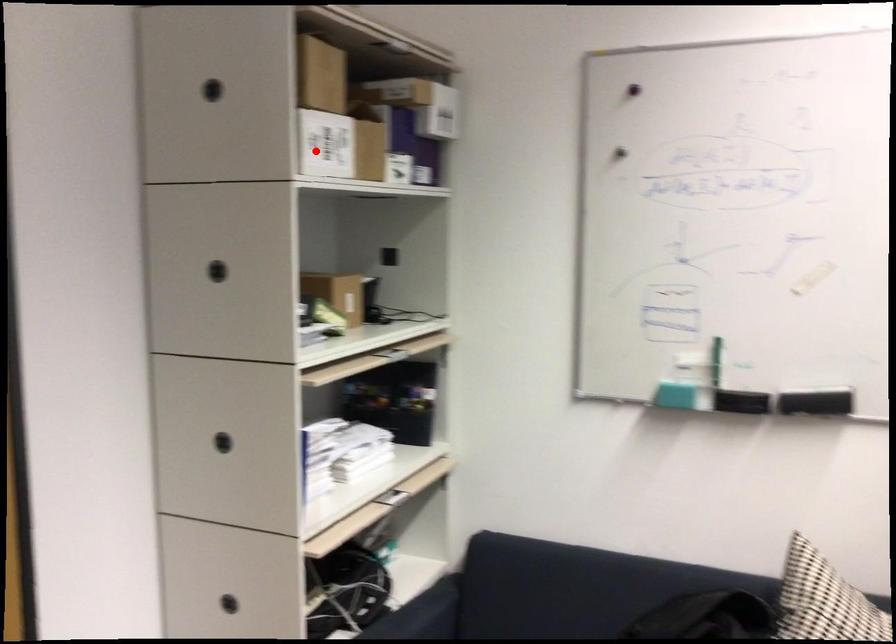
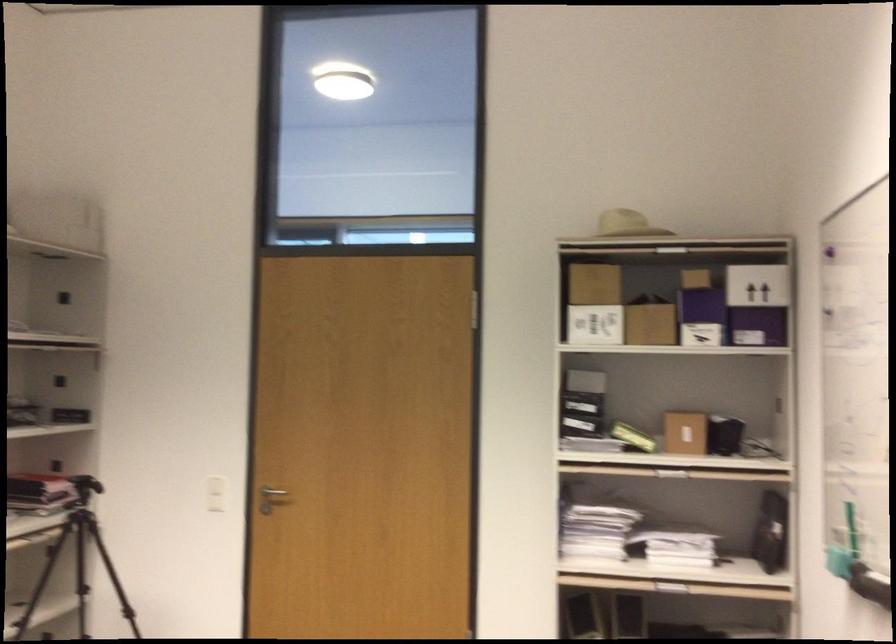
Question: I am providing you with two images of the same scene from different viewpoints. Given a red point in image1, look at the same physical point in image2. Is it:

Choices:
 (A) Closer to the viewpoint
 (B) Farther from the viewpoint

Answer: (B)